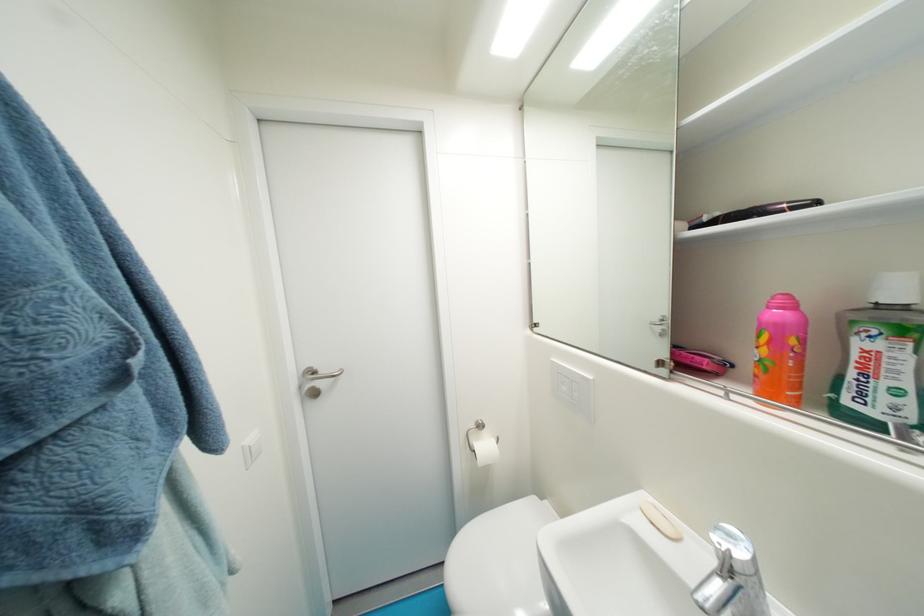
Where is `pink and orange bottle`? pink and orange bottle is located at coordinates (781, 351).